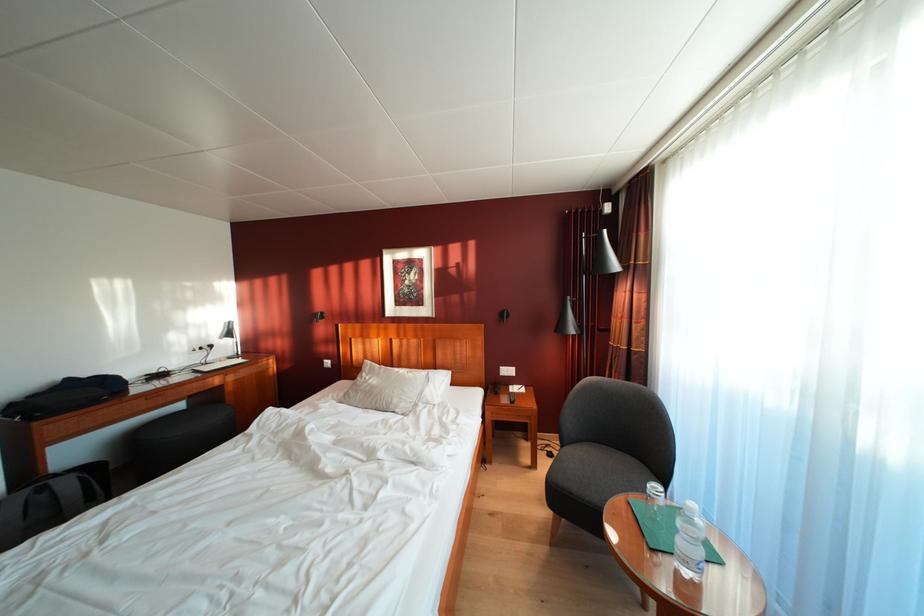
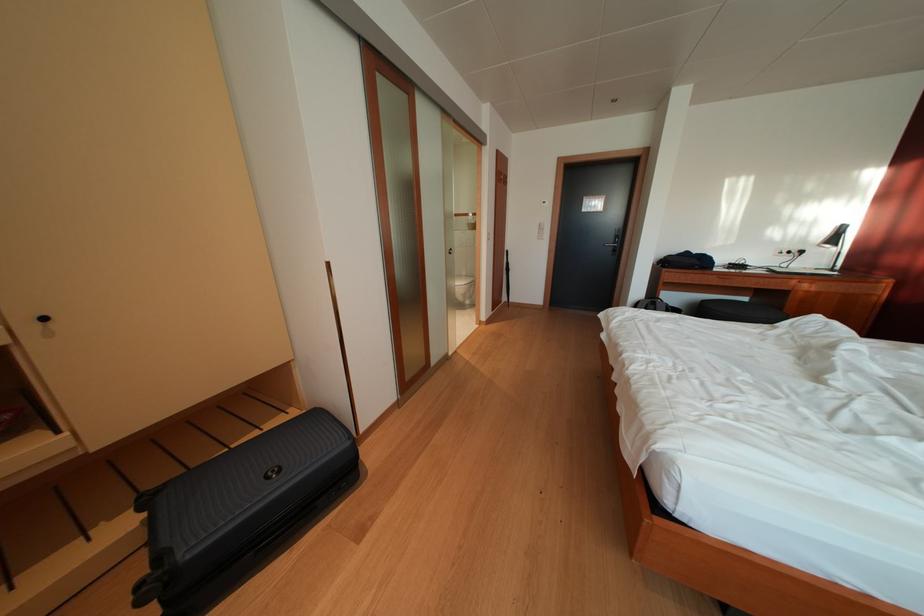
Locate, in the second image, the point that corresponds to pixel 189 411 in the first image.

(752, 305)